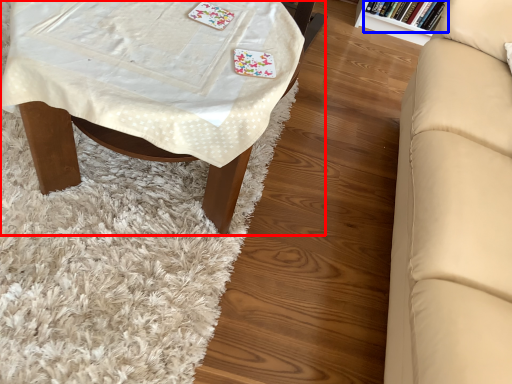
Question: Which of the following is the farthest to the observer, table (highlighted by a red box) or book (highlighted by a blue box)?

Choices:
 (A) table
 (B) book

Answer: (B)